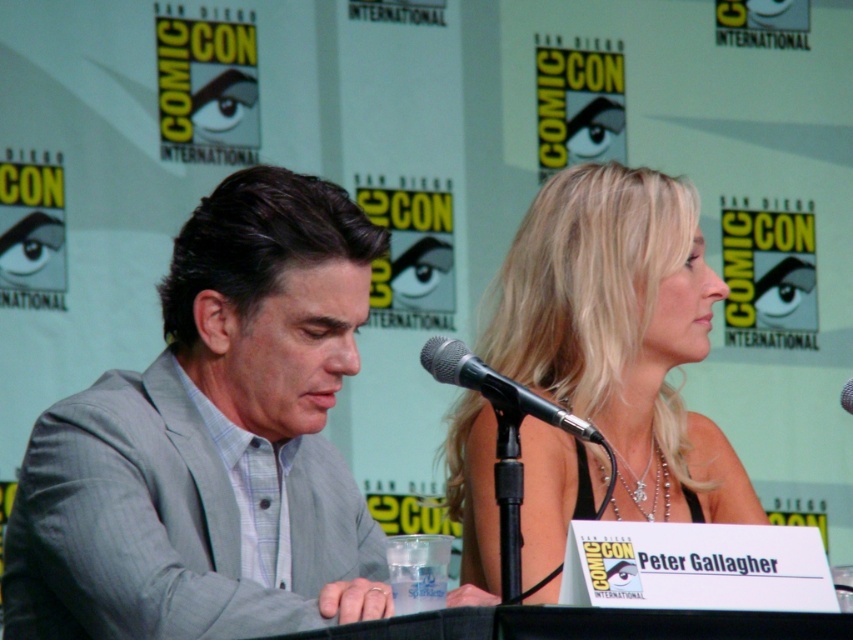
You are a photographer at Comic Con and need to position a light to illuminate the gray pinstripe suit at left. The light can only be placed at point (212, 444). Will placing the light there effectively illuminate the gray pinstripe suit at left?

The gray pinstripe suit at left is located at point (212, 444), so placing the light there will directly illuminate the gray pinstripe suit at left.

You are a photographer at Comic Con who needs to take a group photo of the gray pinstripe suit at left and the black metallic microphone at center. To ensure both are in frame, should you position yourself to the left or right side of the microphone?

Since the gray pinstripe suit at left is to the left of the black metallic microphone at center, you should position yourself to the right side of the microphone to include both in the frame.